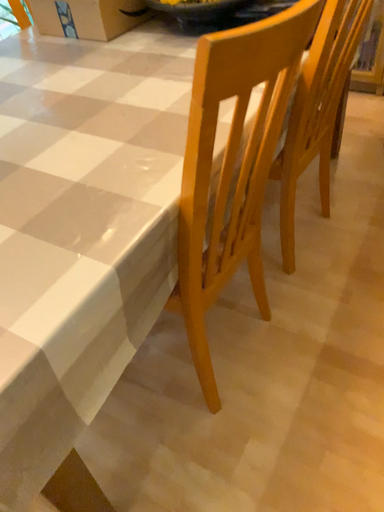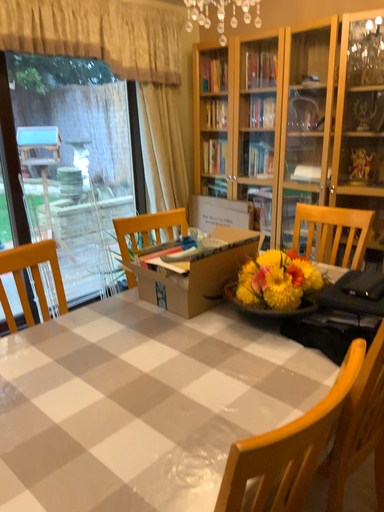
Question: How did the camera likely rotate when shooting the video?

Choices:
 (A) rotated upward
 (B) rotated downward

Answer: (A)